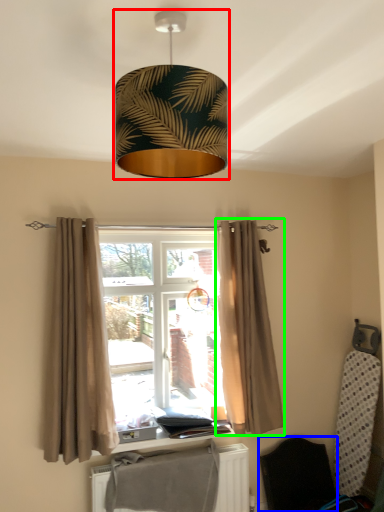
Question: Based on their relative distances, which object is farther from lamp (highlighted by a red box)? Choose from folding chair (highlighted by a blue box) and curtain (highlighted by a green box).

Choices:
 (A) folding chair
 (B) curtain

Answer: (A)